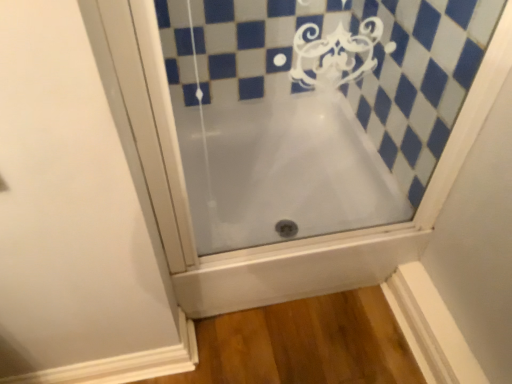
Question: From a real-world perspective, is white frosted glass bathtub at center below white glossy bathtub at center?

Choices:
 (A) no
 (B) yes

Answer: (A)

Question: Is white frosted glass bathtub at center oriented away from white glossy bathtub at center?

Choices:
 (A) no
 (B) yes

Answer: (B)

Question: Considering the relative positions of white frosted glass bathtub at center and white glossy bathtub at center in the image provided, is white frosted glass bathtub at center to the left of white glossy bathtub at center from the viewer's perspective?

Choices:
 (A) yes
 (B) no

Answer: (B)

Question: Considering the relative sizes of white frosted glass bathtub at center and white glossy bathtub at center in the image provided, is white frosted glass bathtub at center wider than white glossy bathtub at center?

Choices:
 (A) no
 (B) yes

Answer: (A)

Question: Can you confirm if white frosted glass bathtub at center is positioned to the right of white glossy bathtub at center?

Choices:
 (A) yes
 (B) no

Answer: (A)

Question: Is white frosted glass bathtub at center aimed at white glossy bathtub at center?

Choices:
 (A) no
 (B) yes

Answer: (A)

Question: Are white glossy bathtub at center and white frosted glass bathtub at center making contact?

Choices:
 (A) no
 (B) yes

Answer: (B)

Question: From the image's perspective, is white glossy bathtub at center beneath white frosted glass bathtub at center?

Choices:
 (A) yes
 (B) no

Answer: (A)

Question: Considering the relative positions of white glossy bathtub at center and white frosted glass bathtub at center in the image provided, is white glossy bathtub at center in front of white frosted glass bathtub at center?

Choices:
 (A) no
 (B) yes

Answer: (A)

Question: From a real-world perspective, is white glossy bathtub at center below white frosted glass bathtub at center?

Choices:
 (A) no
 (B) yes

Answer: (B)

Question: Does white glossy bathtub at center have a greater height compared to white frosted glass bathtub at center?

Choices:
 (A) yes
 (B) no

Answer: (B)

Question: Is white glossy bathtub at center completely or partially outside of white frosted glass bathtub at center?

Choices:
 (A) yes
 (B) no

Answer: (A)

Question: Does point (261, 195) appear closer or farther from the camera than point (253, 18)?

Choices:
 (A) closer
 (B) farther

Answer: (B)